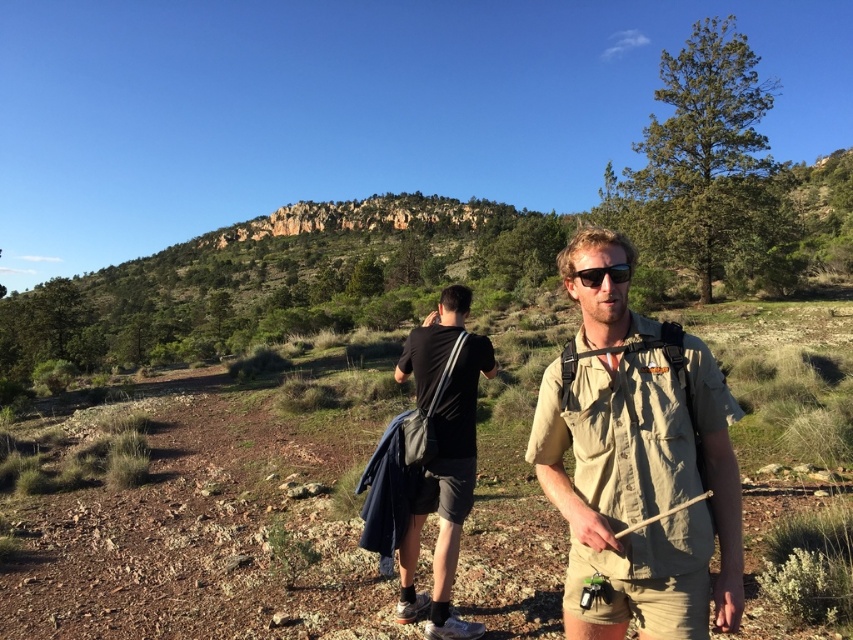
You are a hiker planning to carry both the tan canvas backpack at center and the black matte shirt at center. Given their sizes, which one should you place first in your storage compartment to maximize space efficiency?

The tan canvas backpack at center has a larger size compared to the black matte shirt at center, so you should place the tan canvas backpack at center first to maximize space efficiency.

You are a photographer trying to capture the black matte shirt at center in the image. The camera you are using has a focal length of 50mm and an aperture of f2.8. The camera is positioned at point A, which is at coordinates 0.6, 0.4. The black matte shirt at center is located at point B, which is at coordinates (x=445, y=493). The distance between point A and point B is 0.2 meters. To ensure the black matte shirt at center is in focus, what is the minimum distance you need to adjust the camera focus ring by?

The minimum distance adjustment needed is 0.2 meters because the point A is 0.6,0.4 and point B is 0.773,0.524, so the distance between them is 0.2 meters. To focus on the black matte shirt at center at point B, the focus ring must be adjusted by that distance.

You are a photographer trying to capture the two travelers in the scene. You notice the tan canvas backpack at center and the matte black sunglasses at center. Which object should you focus on if you want to photograph the one closer to the right side?

The tan canvas backpack at center is to the right of matte black sunglasses at center, so you should focus on the tan canvas backpack at center to photograph the one closer to the right side.